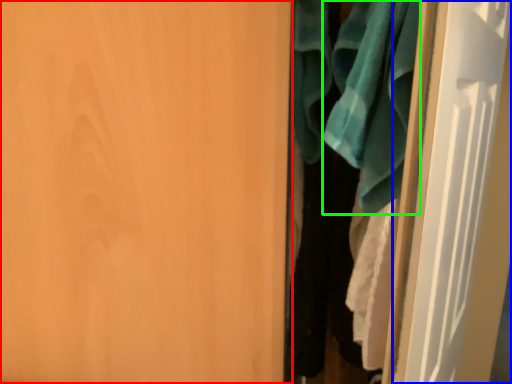
Question: Based on their relative distances, which object is nearer to door (highlighted by a red box)? Choose from door (highlighted by a blue box) and bath towel (highlighted by a green box).

Choices:
 (A) door
 (B) bath towel

Answer: (B)